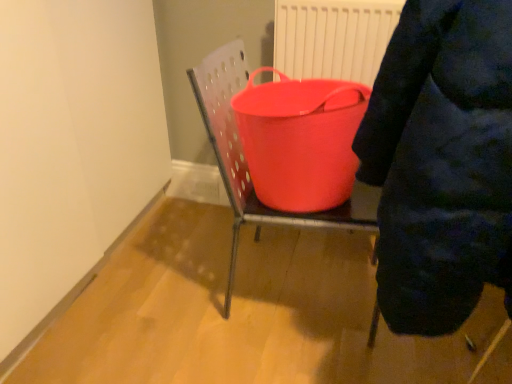
Question: Relative to dark blue puffer jacket at upper right, is rubberized red bucket at center in front or behind?

Choices:
 (A) front
 (B) behind

Answer: (B)

Question: Is rubberized red bucket at center to the left or to the right of dark blue puffer jacket at upper right in the image?

Choices:
 (A) right
 (B) left

Answer: (B)

Question: Which object is positioned farthest from the rubberized plastic bucket at center?

Choices:
 (A) rubberized red bucket at center
 (B) dark blue puffer jacket at upper right

Answer: (B)

Question: Which object is the closest to the rubberized red bucket at center?

Choices:
 (A) rubberized plastic bucket at center
 (B) dark blue puffer jacket at upper right

Answer: (A)